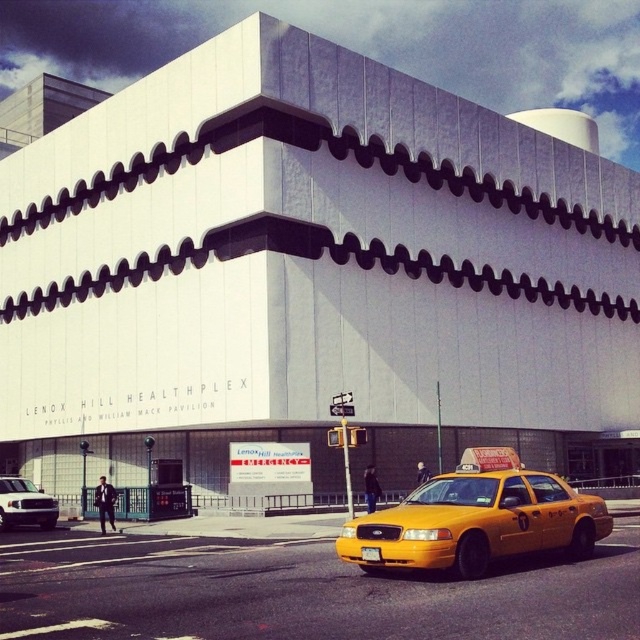
What do you see at coordinates (476, 518) in the screenshot? The height and width of the screenshot is (640, 640). I see `yellow matte taxi at center` at bounding box center [476, 518].

Which is more to the left, yellow matte taxi at center or white matte truck at lower left?

white matte truck at lower left

Is point (468, 563) behind point (49, 513)?

No, (468, 563) is closer to viewer.

At what (x,y) coordinates should I click in order to perform the action: click on yellow matte taxi at center. Please return your answer as a coordinate pair (x, y). The image size is (640, 640). Looking at the image, I should click on (476, 518).